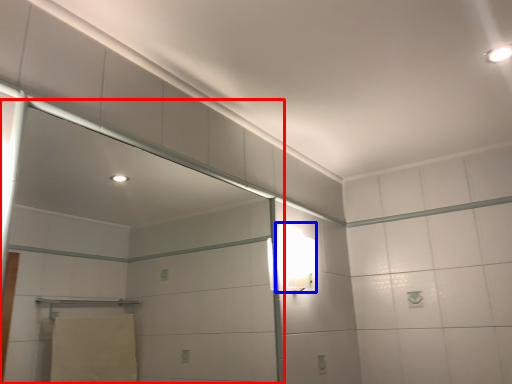
Question: Among these objects, which one is nearest to the camera, screen door (highlighted by a red box) or light fixture (highlighted by a blue box)?

Choices:
 (A) screen door
 (B) light fixture

Answer: (A)